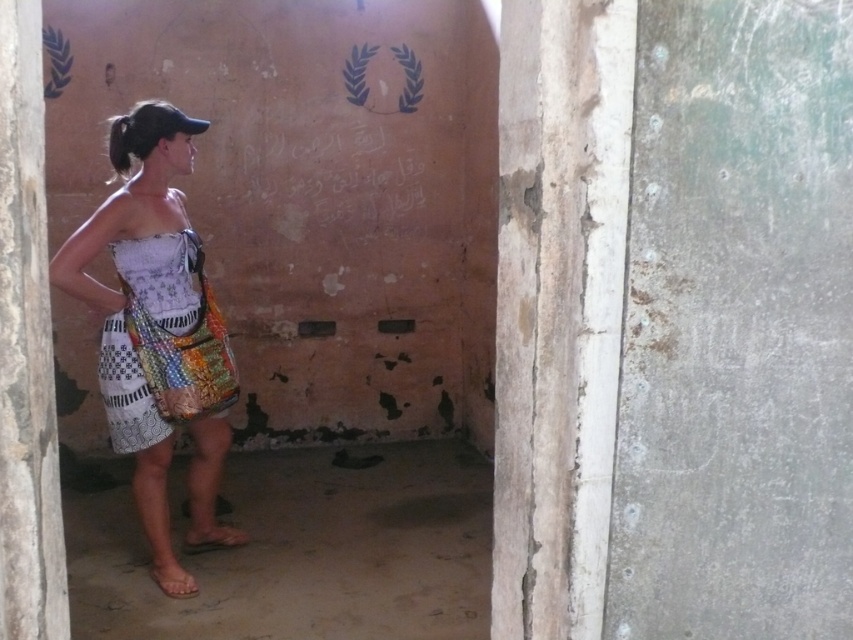
You are a fashion designer observing a woman in a small room. You notice the white patchwork dress at center and the brown leather sandal at lower left. Which item is positioned higher in the image?

The white patchwork dress at center is located above the brown leather sandal at lower left, so the dress is positioned higher.